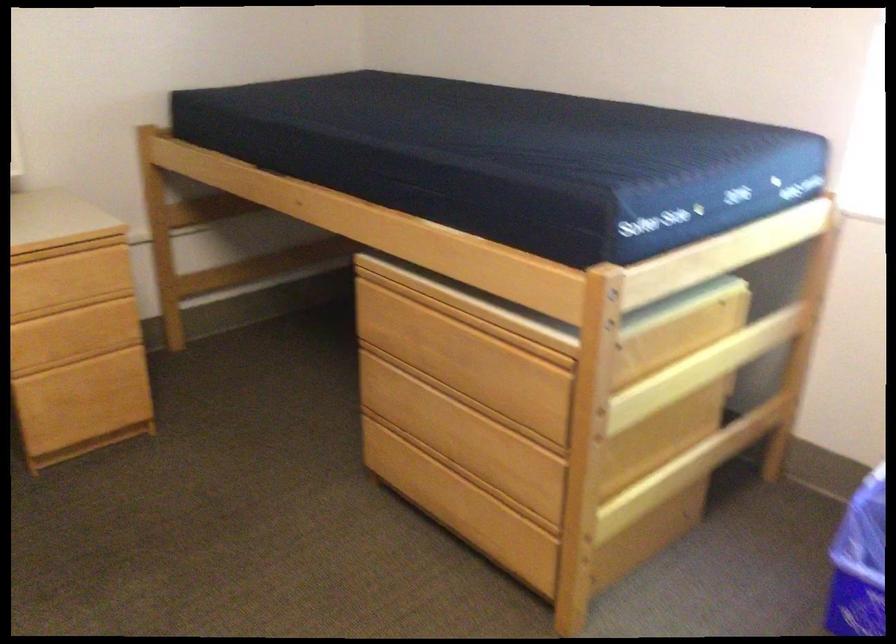
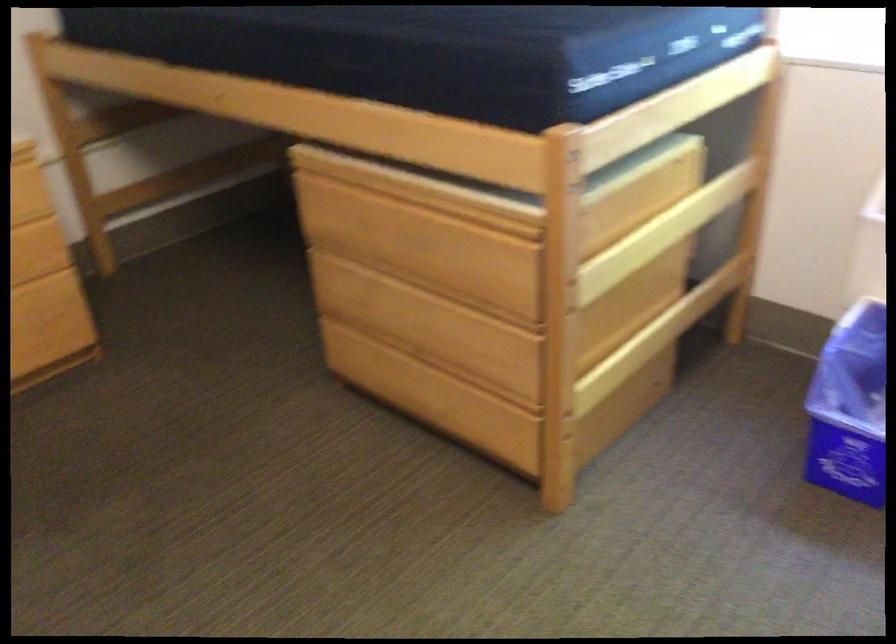
Question: Based on the continuous images, in which direction is the camera rotating? Reply with the corresponding letter.

Choices:
 (A) Left
 (B) Right
 (C) Up
 (D) Down

Answer: (D)